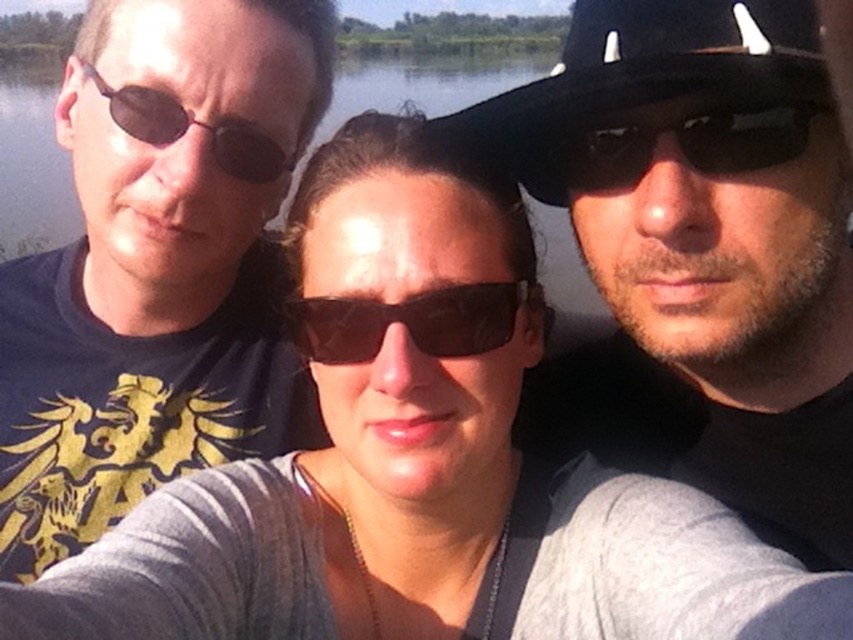
Based on the photo, is clear water at upper left above matte black sunglasses at left?

Yes, clear water at upper left is above matte black sunglasses at left.

Is point (26, 157) farther from viewer compared to point (131, 97)?

Yes.

Who is more distant from viewer, [70,186] or [152,106]?

Point [70,186]

Locate an element on the screen. This screenshot has height=640, width=853. clear water at upper left is located at coordinates (32, 163).

Who is more distant from viewer, (494, 321) or (160, 106)?

Result: Point (160, 106)

Who is positioned more to the right, black matte sunglasses at center or matte black sunglasses at left?

Positioned to the right is black matte sunglasses at center.

This screenshot has height=640, width=853. What are the coordinates of `black matte sunglasses at center` in the screenshot? It's located at (408, 323).

Between point (630, 154) and point (154, 140), which one is positioned behind?

The point (154, 140) is more distant.

Which of these two, matte black hat at upper right or matte black sunglasses at left, stands shorter?

With less height is matte black sunglasses at left.

Which is behind, point (645, 253) or point (109, 102)?

Point (109, 102)

Identify the location of matte black hat at upper right. Image resolution: width=853 pixels, height=640 pixels. (711, 228).